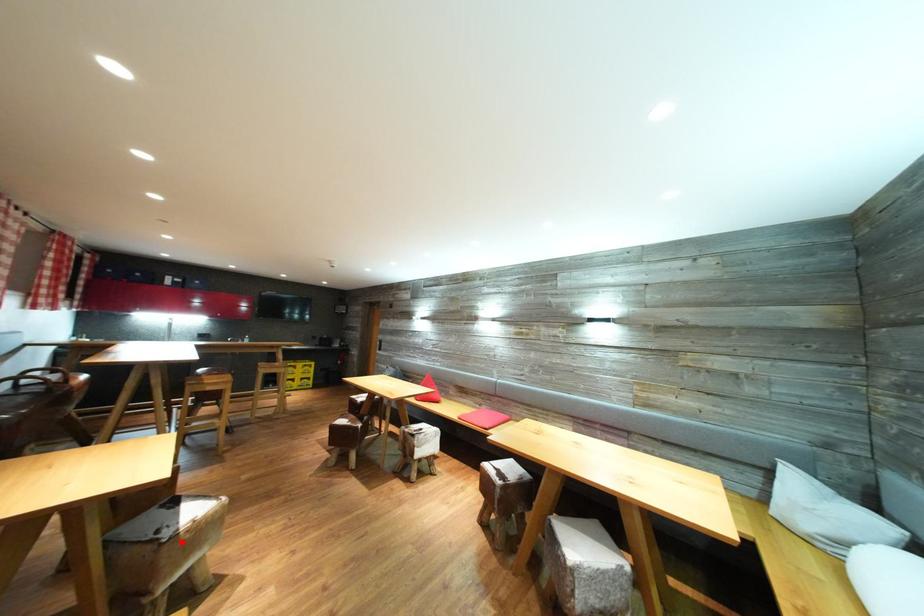
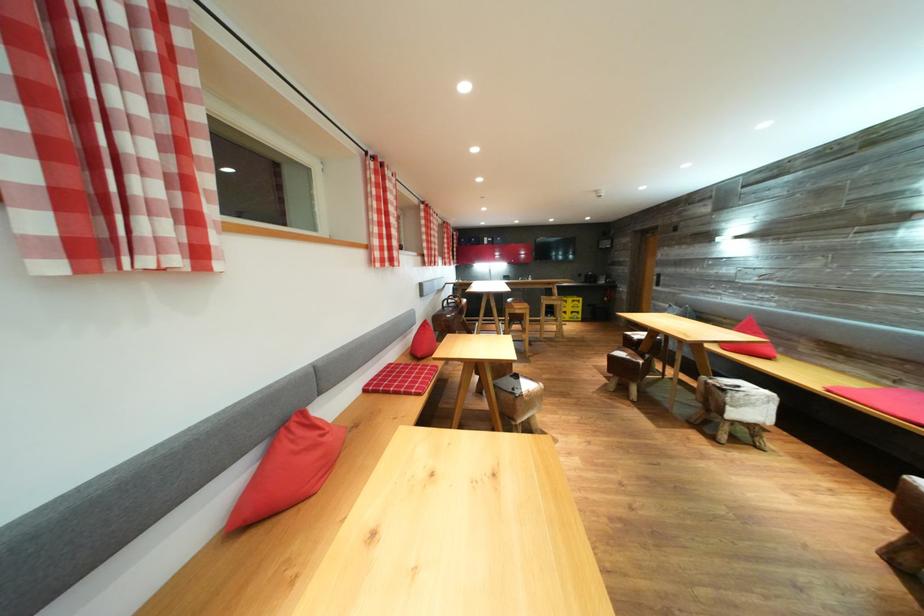
Find the pixel in the second image that matches the highlighted location in the first image.

(528, 400)